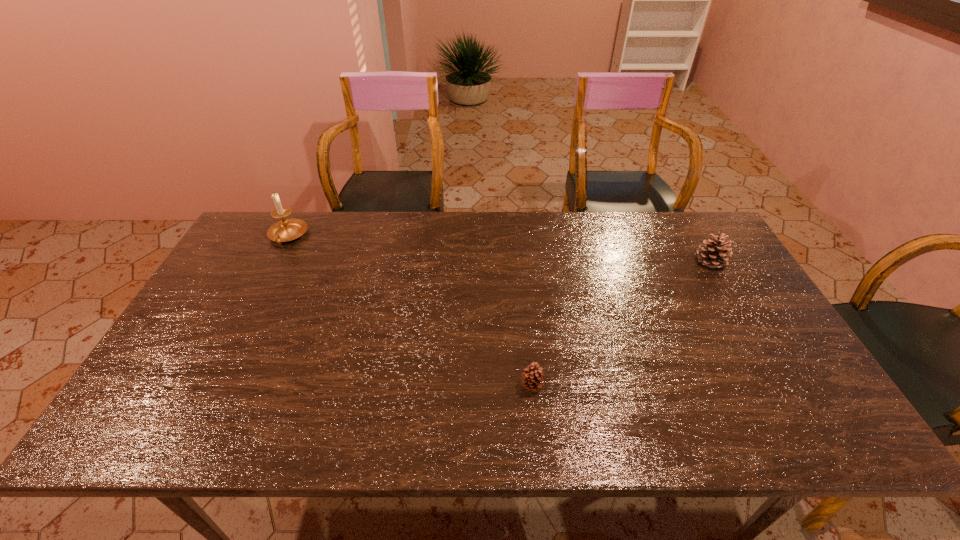
Locate an element on the screen. Image resolution: width=960 pixels, height=540 pixels. free spot between the leftmost object and the nearest object is located at coordinates (410, 311).

This screenshot has width=960, height=540. In order to click on vacant area that lies between the farthest object and the right pinecone in this screenshot , I will do `click(499, 249)`.

At what (x,y) coordinates should I click in order to perform the action: click on vacant space that is in between the nearest object and the farthest object. Please return your answer as a coordinate pair (x, y). Image resolution: width=960 pixels, height=540 pixels. Looking at the image, I should click on (410, 311).

This screenshot has height=540, width=960. Find the location of `vacant region between the right pinecone and the farthest object`. vacant region between the right pinecone and the farthest object is located at coordinates (499, 249).

The height and width of the screenshot is (540, 960). Find the location of `free spot between the shorter pinecone and the candle holder`. free spot between the shorter pinecone and the candle holder is located at coordinates (410, 311).

I want to click on vacant area that lies between the shortest object and the leftmost object, so click(x=410, y=311).

Find the location of a particular element. This screenshot has width=960, height=540. free spot between the second tallest object and the leftmost object is located at coordinates (499, 249).

Locate an element on the screen. free space between the farther pinecone and the candle holder is located at coordinates (499, 249).

Locate an element on the screen. The height and width of the screenshot is (540, 960). vacant space that's between the shorter pinecone and the rightmost object is located at coordinates (621, 324).

Find the location of `free space between the second object from right to left and the candle holder`. free space between the second object from right to left and the candle holder is located at coordinates (410, 311).